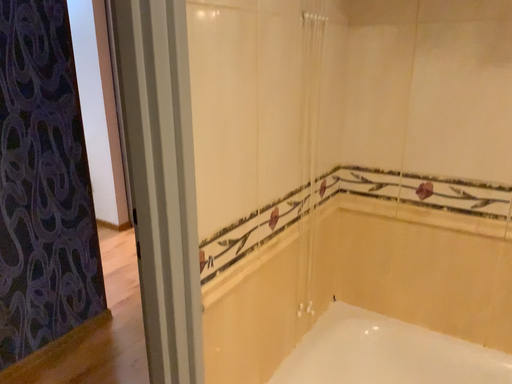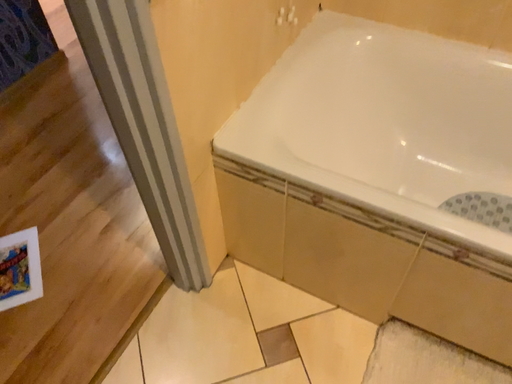
Question: Which way did the camera rotate in the video?

Choices:
 (A) rotated downward
 (B) rotated upward

Answer: (A)